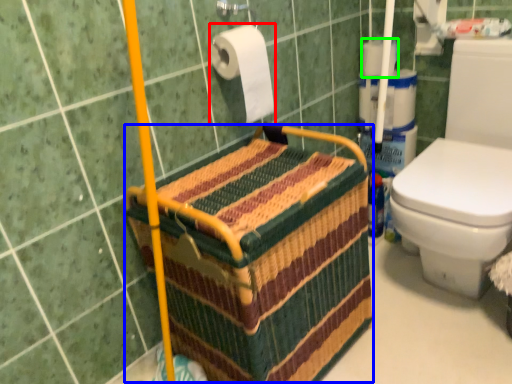
Question: Which is farther away from toilet paper (highlighted by a red box)? basket (highlighted by a blue box) or toilet paper (highlighted by a green box)?

Choices:
 (A) basket
 (B) toilet paper

Answer: (B)